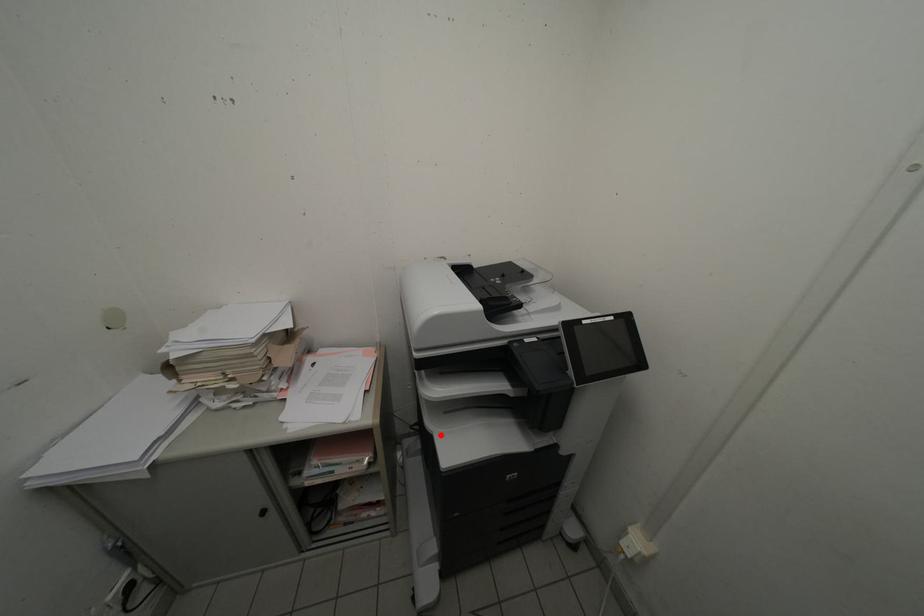
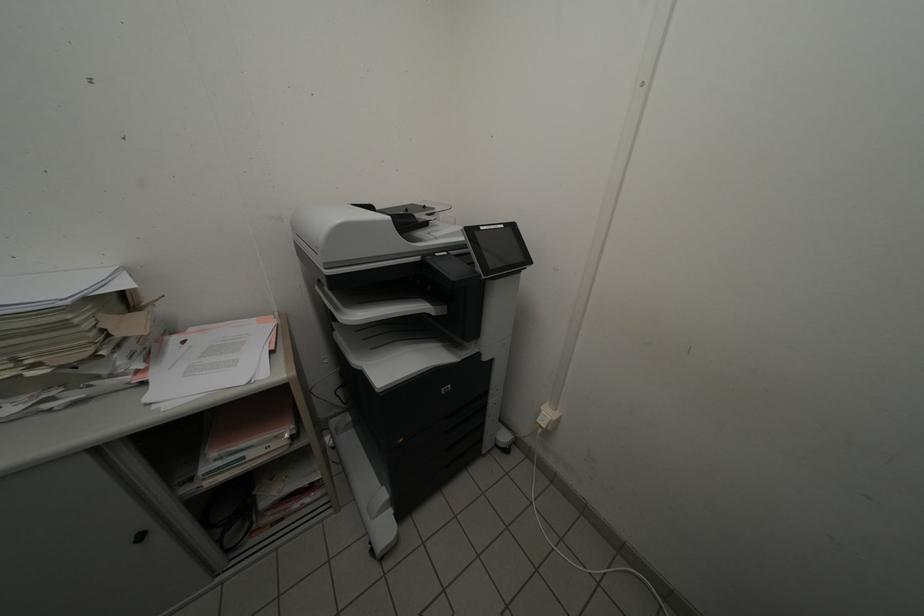
Question: A red point is marked in image1. In image2, is the corresponding 3D point closer to the camera or farther? Reply with the corresponding letter.

Choices:
 (A) The corresponding 3D point is closer.
 (B) The corresponding 3D point is farther.

Answer: (A)